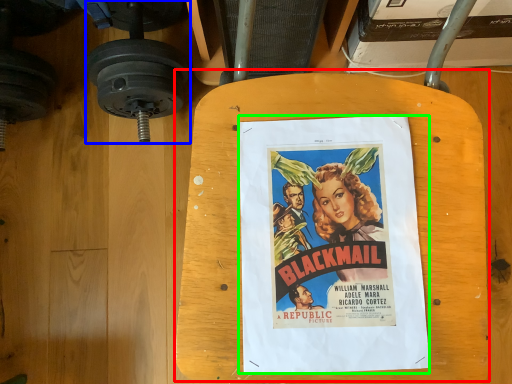
Question: Estimate the real-world distances between objects in this image. Which object is closer to table (highlighted by a red box), dumbbell (highlighted by a blue box) or poster (highlighted by a green box)?

Choices:
 (A) dumbbell
 (B) poster

Answer: (B)